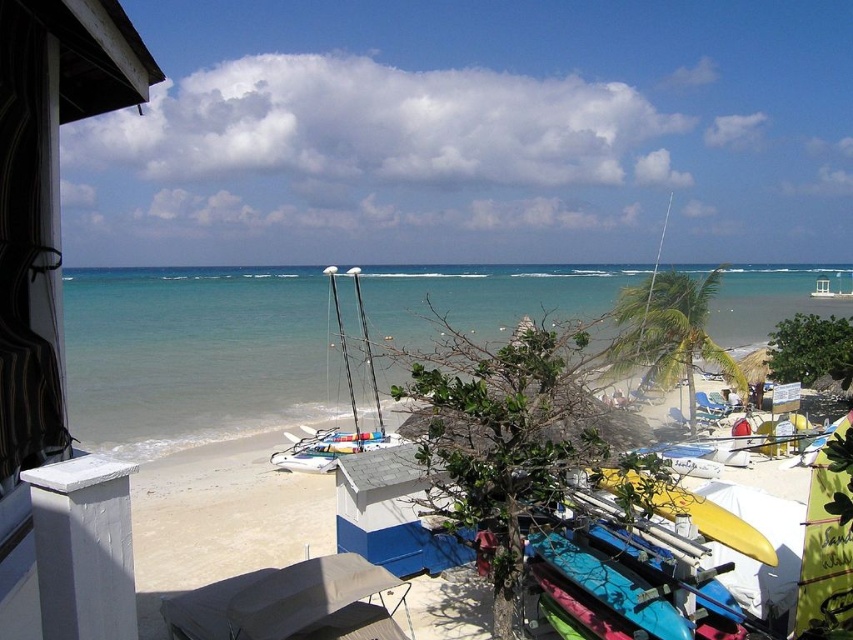
Question: Which object appears farthest from the camera in this image?

Choices:
 (A) white painted wood at left
 (B) white matte sailboat at center
 (C) yellow surfboard at center

Answer: (B)

Question: Which of the following is the farthest from the observer?

Choices:
 (A) (21, 307)
 (B) (202, 268)
 (C) (395, 436)

Answer: (B)

Question: Does clear blue water at center appear on the right side of yellow surfboard at center?

Choices:
 (A) no
 (B) yes

Answer: (B)

Question: From the image, what is the correct spatial relationship of white matte sailboat at center in relation to yellow matte surfboard at center?

Choices:
 (A) above
 (B) below

Answer: (A)

Question: Can you confirm if clear blue water at center is positioned to the right of yellow surfboard at center?

Choices:
 (A) yes
 (B) no

Answer: (A)

Question: Which object appears farthest from the camera in this image?

Choices:
 (A) white matte sailboat at center
 (B) yellow matte surfboard at center

Answer: (A)